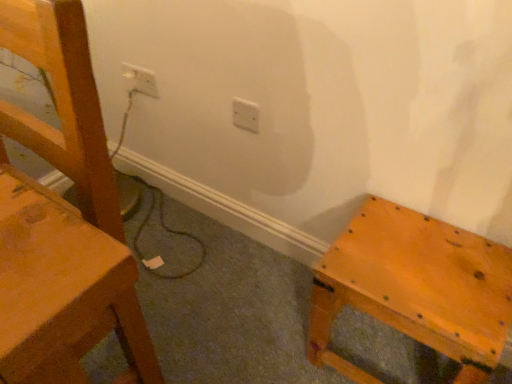
Identify the location of free area below matte wooden stool at lower right (from a real-world perspective). (388, 347).